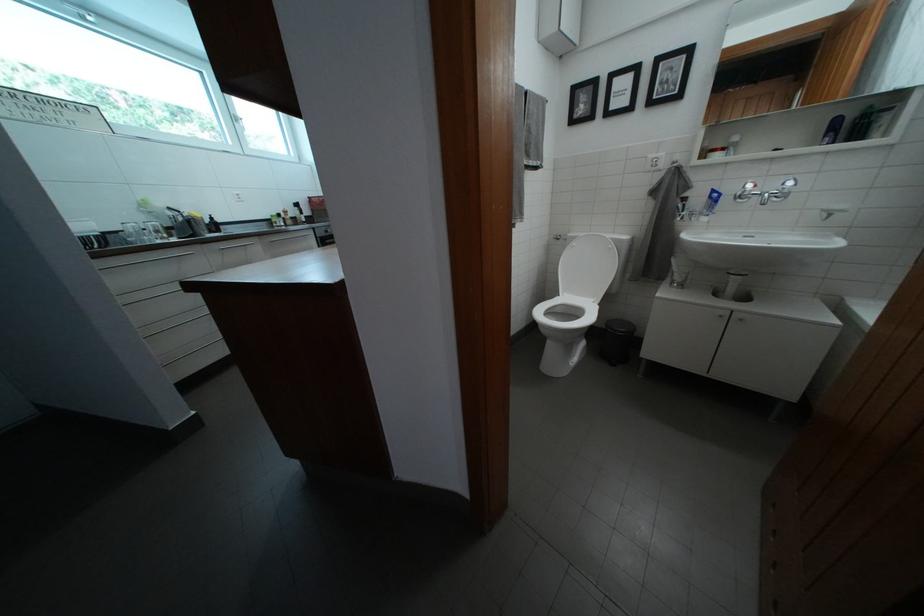
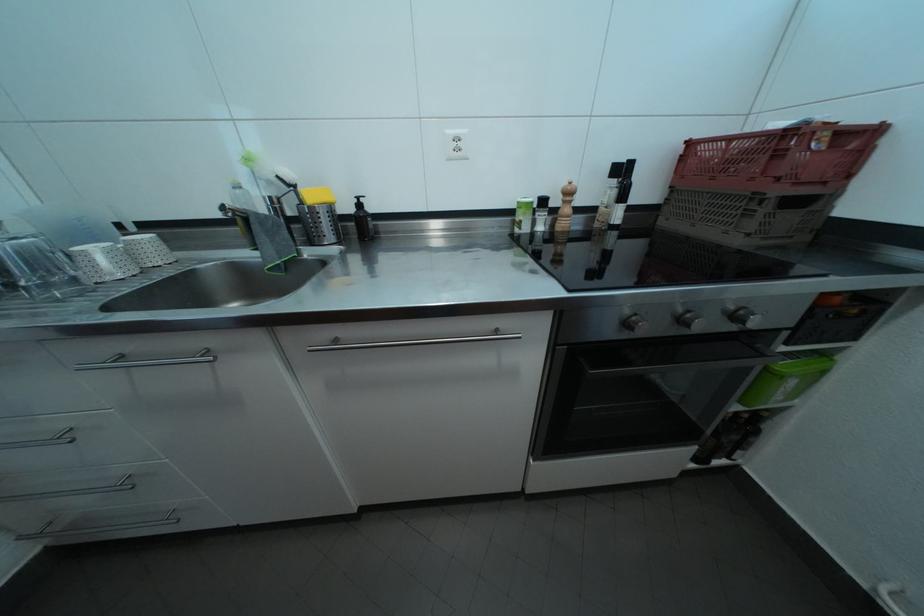
Question: I am providing you with two images of the same scene from different viewpoints. Please identify which objects are invisible in image2.

Choices:
 (A) metal cabinet handle
 (B) patterned paper cup
 (C) faucet handle
 (D) none of these

Answer: (D)